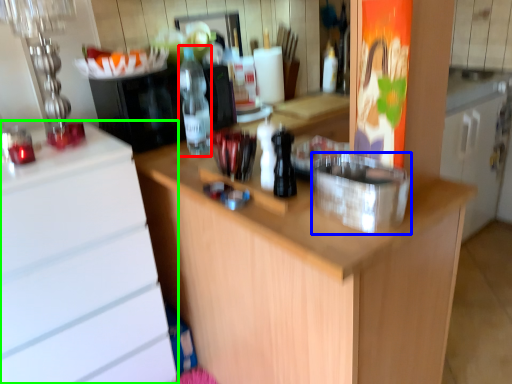
Question: Which is farther away from bottle (highlighted by a red box)? appliance (highlighted by a blue box) or cabinetry (highlighted by a green box)?

Choices:
 (A) appliance
 (B) cabinetry

Answer: (A)